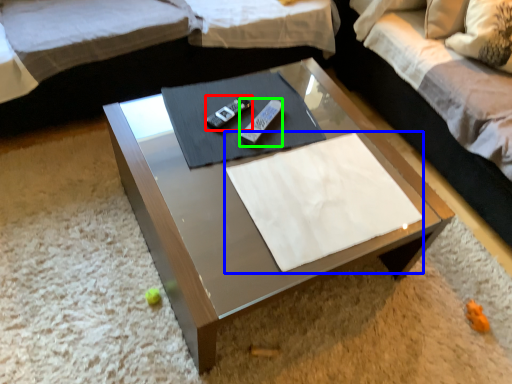
Question: Which object is the farthest from remote (highlighted by a red box)? Choose among these: linen (highlighted by a blue box) or remote (highlighted by a green box).

Choices:
 (A) linen
 (B) remote

Answer: (A)